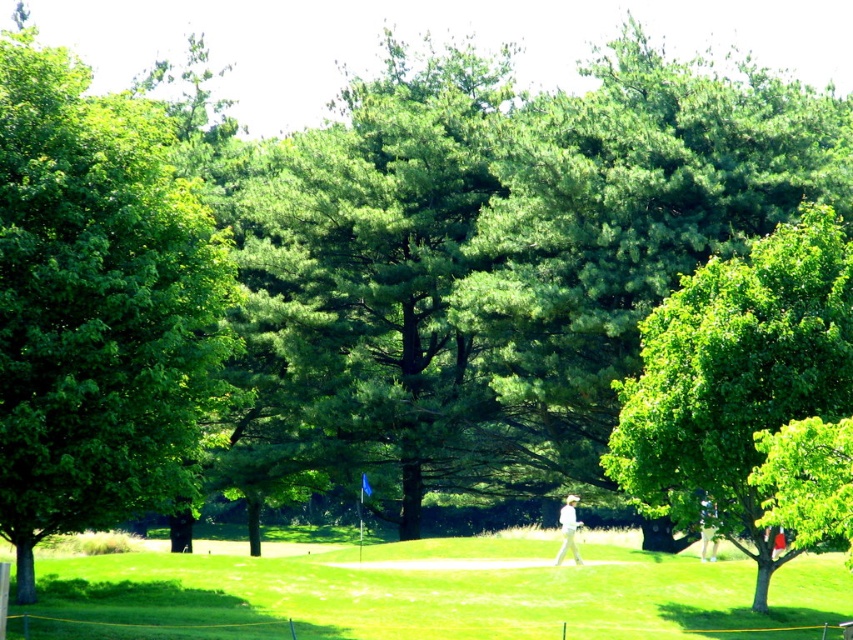
Question: Is green grassy field at center bigger than green leafy tree at right?

Choices:
 (A) yes
 (B) no

Answer: (A)

Question: Which object is the closest to the green grassy field at center?

Choices:
 (A) green leafy tree at right
 (B) green leafy tree at left

Answer: (A)

Question: Is the position of green leafy tree at left more distant than that of white fabric golfer at center?

Choices:
 (A) no
 (B) yes

Answer: (A)

Question: Among these points, which one is nearest to the camera?

Choices:
 (A) (22, 243)
 (B) (698, 396)

Answer: (A)

Question: Does green leafy tree at left appear over white fabric golfer at center?

Choices:
 (A) no
 (B) yes

Answer: (B)

Question: Which point appears farthest from the camera in this image?

Choices:
 (A) 581,563
 (B) 227,600
 (C) 764,237

Answer: (C)